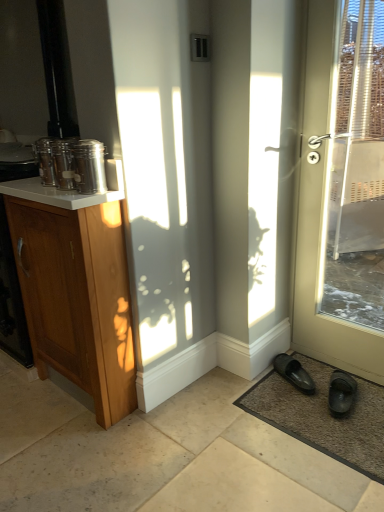
This screenshot has width=384, height=512. In order to click on vacant area to the left of black rubber slipper at lower right, the 1th footwear when ordered from left to right in this screenshot , I will do `click(263, 389)`.